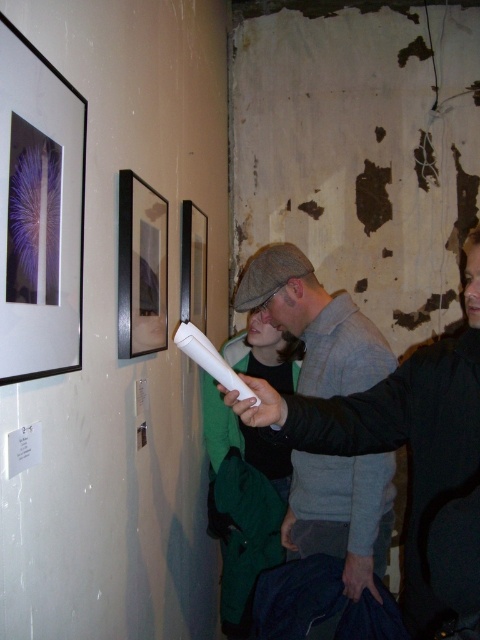
This screenshot has height=640, width=480. In order to click on black glossy picture frame at upper center in this screenshot , I will do `click(193, 266)`.

The image size is (480, 640). I want to click on black glossy picture frame at upper center, so click(x=193, y=266).

Is matte black picture frame at upper left further to the viewer compared to white matte wii remote at center?

No, it is in front of white matte wii remote at center.

Image resolution: width=480 pixels, height=640 pixels. I want to click on matte black picture frame at upper left, so click(x=38, y=212).

Is point (33, 218) behind point (199, 340)?

No.

At what (x,y) coordinates should I click in order to perform the action: click on matte black picture frame at upper left. Please return your answer as a coordinate pair (x, y). The image size is (480, 640). Looking at the image, I should click on (38, 212).

Which is below, matte gray cap at center or white matte wii remote at center?

Positioned lower is matte gray cap at center.

Is matte gray cap at center positioned at the back of white matte wii remote at center?

That is True.

Does point (283, 291) come closer to viewer compared to point (194, 340)?

That is False.

The height and width of the screenshot is (640, 480). In order to click on matte gray cap at center in this screenshot , I will do `click(314, 323)`.